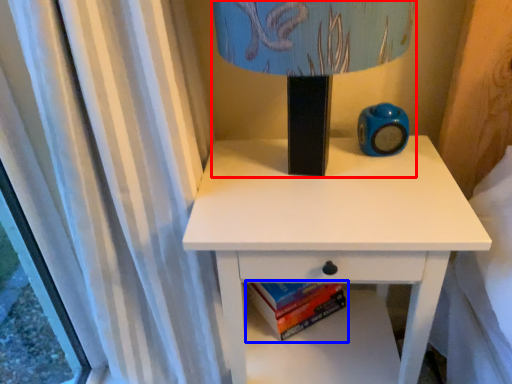
Question: Which point is further to the camera, table lamp (highlighted by a red box) or paperback book (highlighted by a blue box)?

Choices:
 (A) table lamp
 (B) paperback book

Answer: (B)